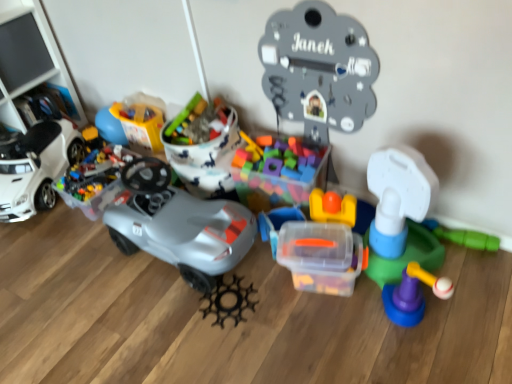
Question: Considering the relative sizes of translucent plastic container at center, acting as the 5th toy starting from the left, and translucent plastic container at upper left, the seventh toy positioned from the right, in the image provided, is translucent plastic container at center, acting as the 5th toy starting from the left, wider than translucent plastic container at upper left, the seventh toy positioned from the right,?

Choices:
 (A) yes
 (B) no

Answer: (B)

Question: Is translucent plastic container at center, which is counted as the 4th toy, starting from the right, smaller than translucent plastic container at upper left, the seventh toy positioned from the right?

Choices:
 (A) yes
 (B) no

Answer: (A)

Question: Does translucent plastic container at center, acting as the 5th toy starting from the left, appear on the left side of translucent plastic container at upper left, the seventh toy positioned from the right?

Choices:
 (A) no
 (B) yes

Answer: (A)

Question: Is translucent plastic container at center, which is counted as the 4th toy, starting from the right, closer to camera compared to translucent plastic container at upper left, the seventh toy positioned from the right?

Choices:
 (A) no
 (B) yes

Answer: (B)

Question: Is translucent plastic container at upper left, the 2th toy from the left, inside translucent plastic container at center, which is counted as the 4th toy, starting from the right?

Choices:
 (A) yes
 (B) no

Answer: (B)

Question: Considering their positions, is metallic gray clock at upper center, placed as the 3th toy when sorted from right to left, located in front of or behind translucent plastic container at center, which is counted as the 4th toy, starting from the right?

Choices:
 (A) front
 (B) behind

Answer: (A)

Question: Considering the relative positions of metallic gray clock at upper center, the sixth toy from the left, and translucent plastic container at center, which is counted as the 4th toy, starting from the right, in the image provided, is metallic gray clock at upper center, the sixth toy from the left, to the left or to the right of translucent plastic container at center, which is counted as the 4th toy, starting from the right,?

Choices:
 (A) right
 (B) left

Answer: (A)

Question: Considering the positions of metallic gray clock at upper center, placed as the 3th toy when sorted from right to left, and translucent plastic container at center, acting as the 5th toy starting from the left, in the image, is metallic gray clock at upper center, placed as the 3th toy when sorted from right to left, bigger or smaller than translucent plastic container at center, acting as the 5th toy starting from the left,?

Choices:
 (A) big
 (B) small

Answer: (A)

Question: From their relative heights in the image, would you say metallic gray clock at upper center, placed as the 3th toy when sorted from right to left, is taller or shorter than translucent plastic container at center, acting as the 5th toy starting from the left?

Choices:
 (A) tall
 (B) short

Answer: (A)

Question: Is point (4, 173) positioned closer to the camera than point (285, 218)?

Choices:
 (A) farther
 (B) closer

Answer: (A)

Question: From the image's perspective, is white matte toy car at left located above or below translucent plastic container at center, which is counted as the 4th toy, starting from the right?

Choices:
 (A) below
 (B) above

Answer: (B)

Question: From a real-world perspective, is white matte toy car at left physically located above or below translucent plastic container at center, which is counted as the 4th toy, starting from the right?

Choices:
 (A) above
 (B) below

Answer: (A)

Question: Is white matte toy car at left taller or shorter than translucent plastic container at center, which is counted as the 4th toy, starting from the right?

Choices:
 (A) short
 (B) tall

Answer: (B)

Question: From the image's perspective, is matte gray car at center, acting as the sixth toy starting from the right, above or below translucent plastic container at center, which is counted as the 4th toy, starting from the right?

Choices:
 (A) below
 (B) above

Answer: (B)

Question: Is matte gray car at center, acting as the sixth toy starting from the right, inside the boundaries of translucent plastic container at center, which is counted as the 4th toy, starting from the right, or outside?

Choices:
 (A) inside
 (B) outside

Answer: (B)